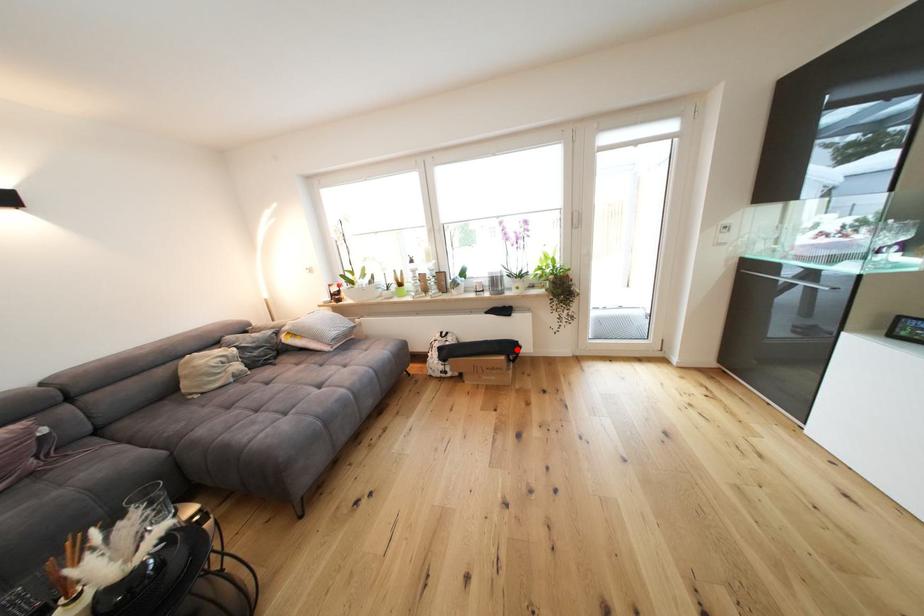
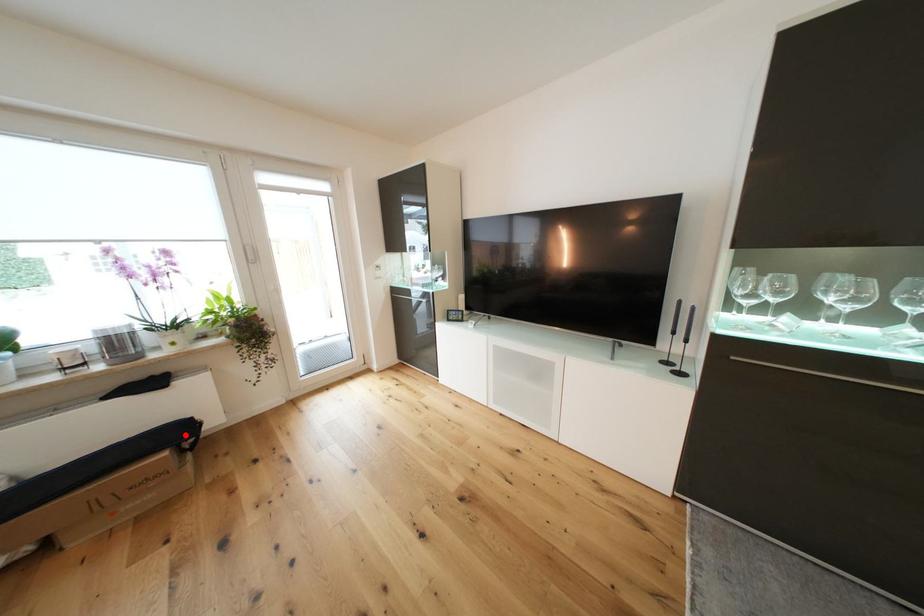
I am providing you with two images of the same scene from different viewpoints. A red point is marked on the first image and another point is marked on the second image. Are the points marked in image1 and image2 representing the same 3D position?

Yes